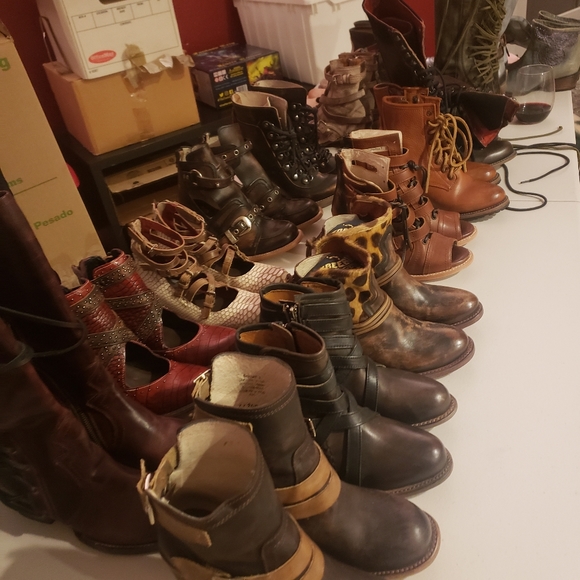
The image size is (580, 580). In order to click on wall in this screenshot , I will do tap(213, 26).